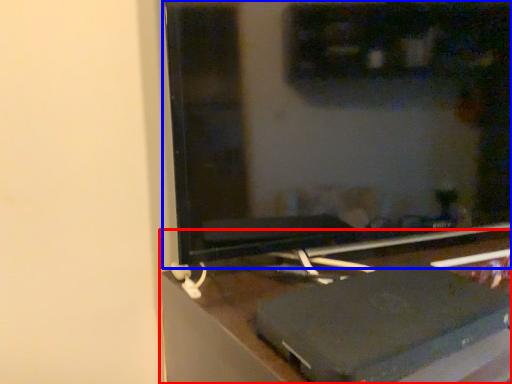
Question: Which object appears farthest to the camera in this image, furniture (highlighted by a red box) or computer monitor (highlighted by a blue box)?

Choices:
 (A) furniture
 (B) computer monitor

Answer: (B)